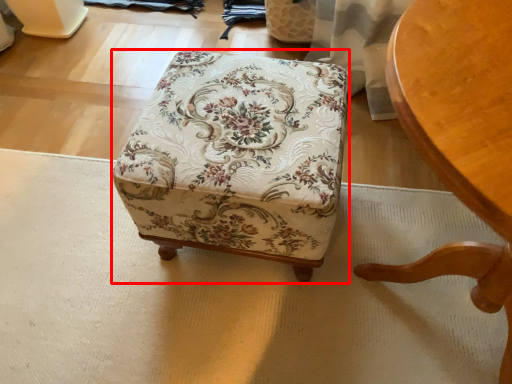
Question: Observing the image, what is the correct spatial positioning of furniture (annotated by the red box) in reference to chair?

Choices:
 (A) right
 (B) left

Answer: (B)